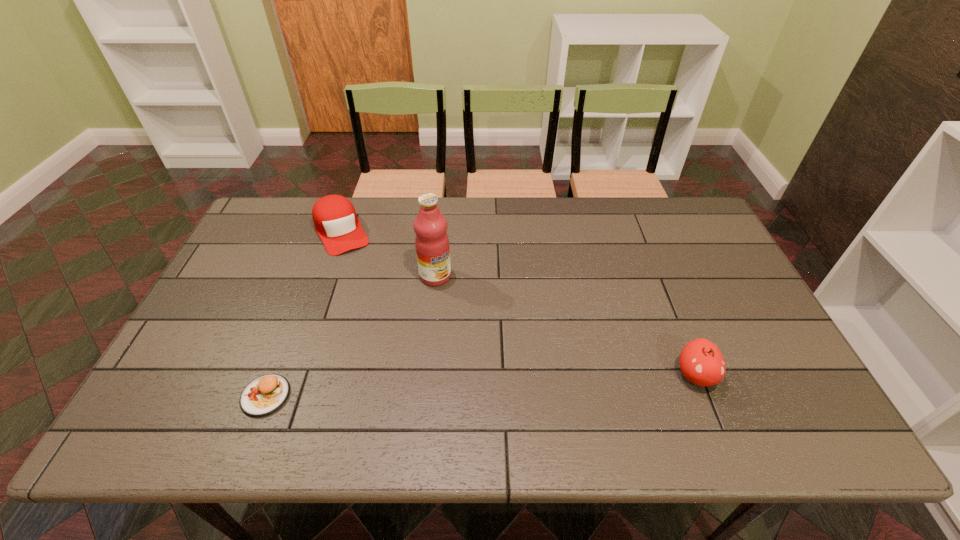
This screenshot has height=540, width=960. In order to click on vacant space situated on the front-facing side of the baseball cap in this screenshot , I will do `click(385, 323)`.

The width and height of the screenshot is (960, 540). I want to click on vacant space situated on the front-facing side of the baseball cap, so click(387, 328).

Where is `free region located 0.400m on the front-facing side of the baseball cap`? free region located 0.400m on the front-facing side of the baseball cap is located at coordinates (396, 345).

The width and height of the screenshot is (960, 540). Find the location of `object present at the far edge`. object present at the far edge is located at coordinates point(335,220).

Identify the location of patty positioned at the near edge. This screenshot has height=540, width=960. (265, 394).

This screenshot has width=960, height=540. What are the coordinates of `apple that is at the near edge` in the screenshot? It's located at (701, 362).

Locate an element on the screen. This screenshot has width=960, height=540. free space at the far edge is located at coordinates (463, 209).

This screenshot has height=540, width=960. In the image, there is a desktop. Identify the location of vacant space at the near edge. (597, 395).

You are a GUI agent. You are given a task and a screenshot of the screen. Output one action in this format:
    pyautogui.click(x=<x>, y=<y>)
    Task: Click on the vacant area at the left edge of the desktop
    
    Given the screenshot: What is the action you would take?
    pyautogui.click(x=204, y=356)

In the image, there is a desktop. At what (x,y) coordinates should I click in order to perform the action: click on free space at the far left corner. Please return your answer as a coordinate pair (x, y). The image size is (960, 540). Looking at the image, I should click on (259, 214).